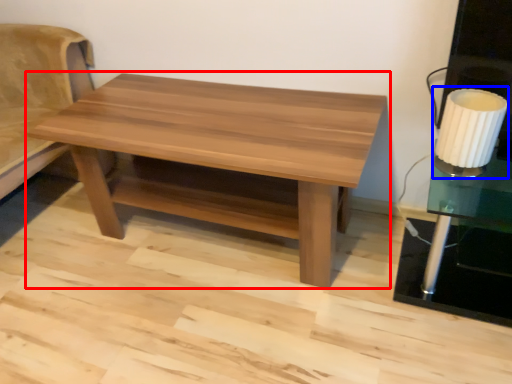
Question: Which of the following is the closest to the observer, coffee table (highlighted by a red box) or table lamp (highlighted by a blue box)?

Choices:
 (A) coffee table
 (B) table lamp

Answer: (A)